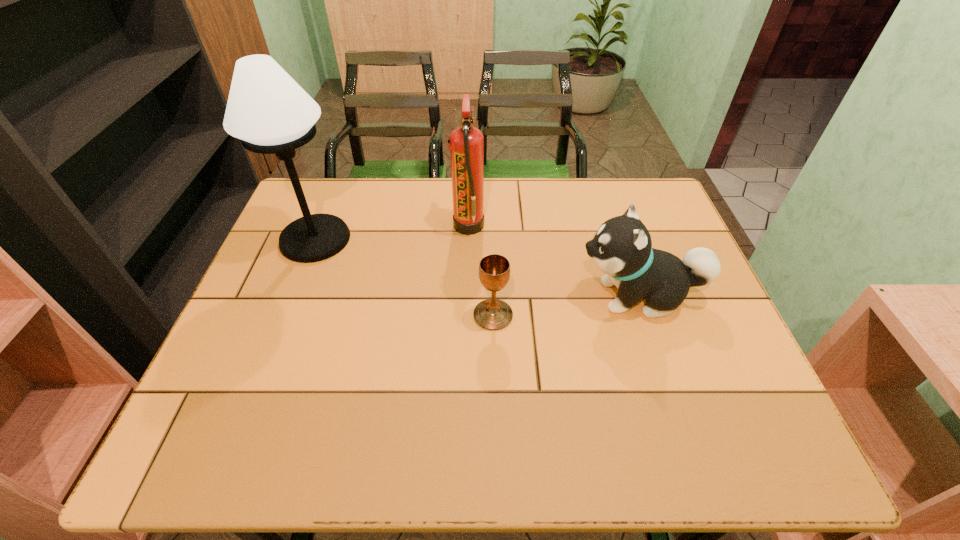
You are a GUI agent. You are given a task and a screenshot of the screen. Output one action in this format:
    pyautogui.click(x=<x>, y=<y>)
    Task: Click on the free location at the far right corner of the desktop
    
    Given the screenshot: What is the action you would take?
    pyautogui.click(x=626, y=179)

Locate an element on the screen. The image size is (960, 540). vacant region at the near right corner of the desktop is located at coordinates (716, 441).

Identify the location of vacant region between the shortest object and the leftmost object. (404, 277).

Where is `blank region between the tallest object and the third tallest object`? Image resolution: width=960 pixels, height=540 pixels. blank region between the tallest object and the third tallest object is located at coordinates (477, 268).

The height and width of the screenshot is (540, 960). Find the location of `free space that is in between the rightmost object and the third shortest object`. free space that is in between the rightmost object and the third shortest object is located at coordinates (x=554, y=261).

Image resolution: width=960 pixels, height=540 pixels. What are the coordinates of `vacant area that lies between the fire extinguisher and the table lamp` in the screenshot? It's located at (392, 233).

At what (x,y) coordinates should I click in order to perform the action: click on free spot between the puppy and the third shortest object. Please return your answer as a coordinate pair (x, y). Looking at the image, I should click on (554, 261).

Locate an element on the screen. The width and height of the screenshot is (960, 540). vacant region between the third tallest object and the chalice is located at coordinates (566, 306).

You are a GUI agent. You are given a task and a screenshot of the screen. Output one action in this format:
    pyautogui.click(x=<x>, y=<y>)
    Task: Click on the free point between the rightmost object and the shortest object
    
    Given the screenshot: What is the action you would take?
    pyautogui.click(x=566, y=306)

Identify the location of empty location between the tallest object and the fire extinguisher. (392, 233).